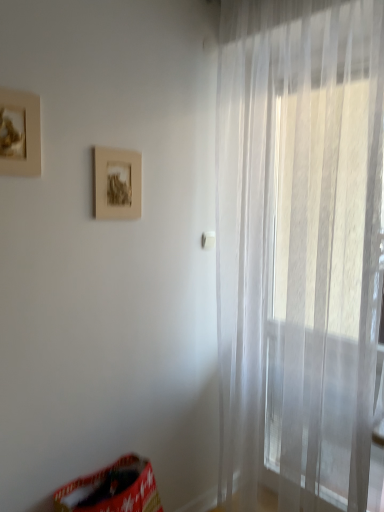
Question: From their relative heights in the image, would you say transparent fabric curtain at right is taller or shorter than matte brown picture frame at center, which is the second picture frame from left to right?

Choices:
 (A) short
 (B) tall

Answer: (B)

Question: From a real-world perspective, is transparent fabric curtain at right physically located above or below matte brown picture frame at center, the 1th picture frame from the right?

Choices:
 (A) above
 (B) below

Answer: (B)

Question: Considering the real-world distances, which object is closest to the matte gold picture frame at upper left, acting as the 1th picture frame starting from the left?

Choices:
 (A) red fabric bean bag chair at lower left
 (B) transparent fabric curtain at right
 (C) matte brown picture frame at center, which is the second picture frame from front to back

Answer: (C)

Question: Which is nearer to the transparent fabric curtain at right?

Choices:
 (A) red fabric bean bag chair at lower left
 (B) matte gold picture frame at upper left, which ranks as the first picture frame in front-to-back order
 (C) matte brown picture frame at center, which is the second picture frame from front to back

Answer: (C)